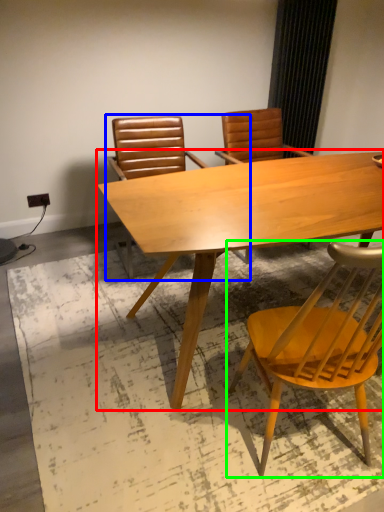
Question: Considering the real-world distances, which object is closest to table (highlighted by a red box)? chair (highlighted by a blue box) or chair (highlighted by a green box).

Choices:
 (A) chair
 (B) chair

Answer: (B)